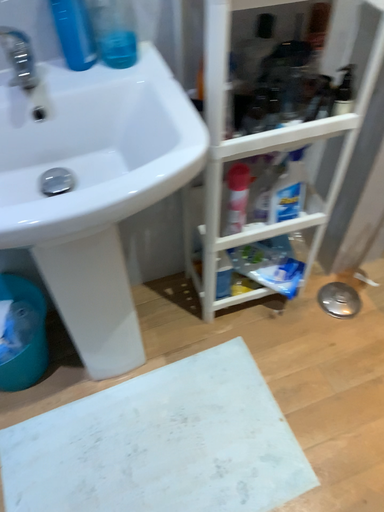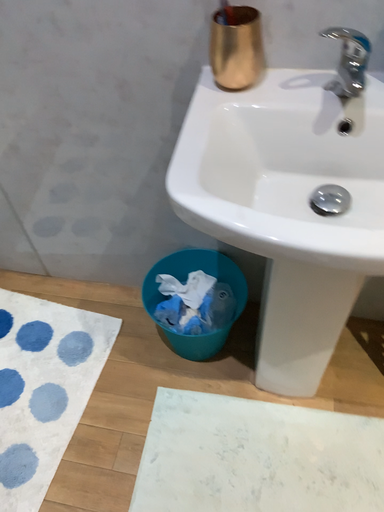
Question: Which way did the camera rotate in the video?

Choices:
 (A) rotated left
 (B) rotated right

Answer: (A)